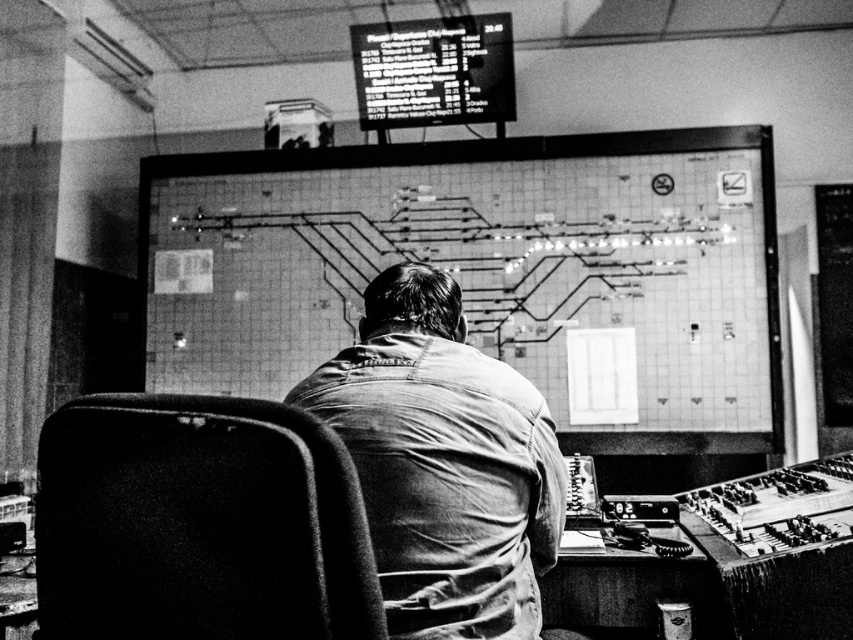
Question: Can you confirm if denim shirt at center is positioned below black plastic screen at upper center?

Choices:
 (A) yes
 (B) no

Answer: (A)

Question: Considering the real-world distances, which object is closest to the velvety black chair at center?

Choices:
 (A) denim shirt at center
 (B) black plastic screen at upper center

Answer: (A)

Question: Estimate the real-world distances between objects in this image. Which object is farther from the black plastic screen at upper center?

Choices:
 (A) velvety black chair at center
 (B) denim shirt at center

Answer: (A)

Question: Can you confirm if velvety black chair at center is positioned to the right of denim shirt at center?

Choices:
 (A) yes
 (B) no

Answer: (B)

Question: Which point is farther to the camera?

Choices:
 (A) (305, 593)
 (B) (430, 572)
 (C) (434, 88)

Answer: (C)

Question: Is velvety black chair at center thinner than denim shirt at center?

Choices:
 (A) yes
 (B) no

Answer: (A)